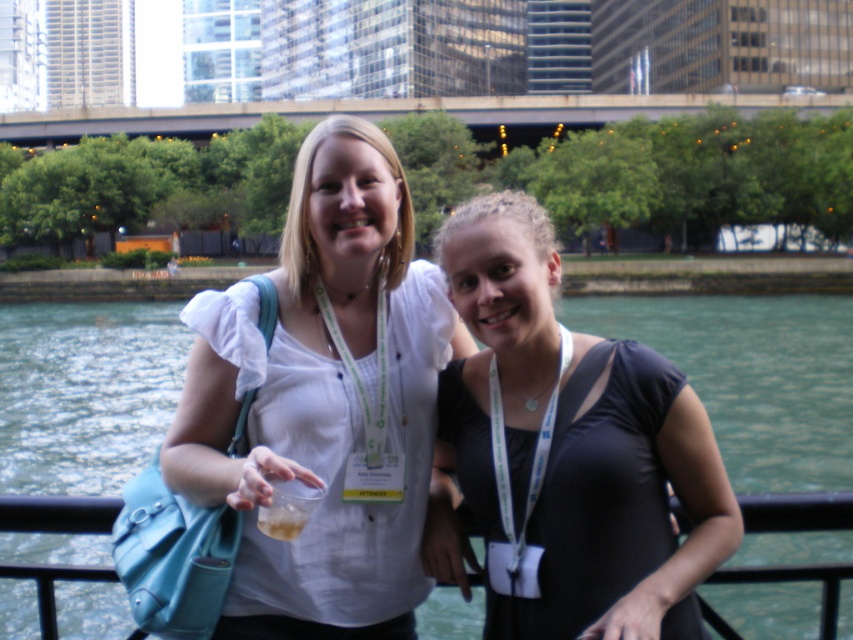
Can you confirm if white matte shirt at center is shorter than green water at river right?

Yes, white matte shirt at center is shorter than green water at river right.

Between white matte shirt at center and green water at river right, which one is positioned lower?

green water at river right

You are a GUI agent. You are given a task and a screenshot of the screen. Output one action in this format:
    pyautogui.click(x=<x>, y=<y>)
    Task: Click on the white matte shirt at center
    
    Given the screenshot: What is the action you would take?
    [x=325, y=401]

Where is `white matte shirt at center`? white matte shirt at center is located at coordinates (x=325, y=401).

Which is behind, point (32, 429) or point (56, 573)?

Positioned behind is point (32, 429).

Between green water at river right and black metal railing at lower center, which one appears on the left side from the viewer's perspective?

Positioned to the left is black metal railing at lower center.

The image size is (853, 640). I want to click on green water at river right, so click(752, 376).

Locate an element on the screen. The image size is (853, 640). green water at river right is located at coordinates (752, 376).

Can you confirm if white matte shirt at center is thinner than black metal railing at lower center?

In fact, white matte shirt at center might be wider than black metal railing at lower center.

Where is `white matte shirt at center`? white matte shirt at center is located at coordinates pos(325,401).